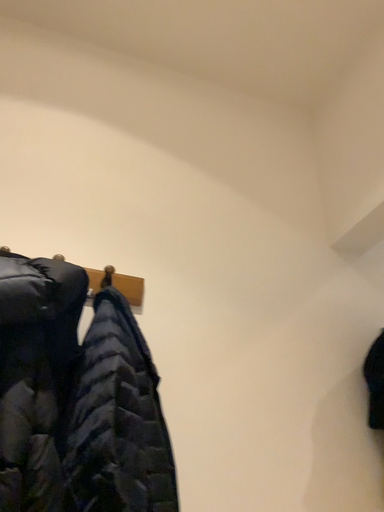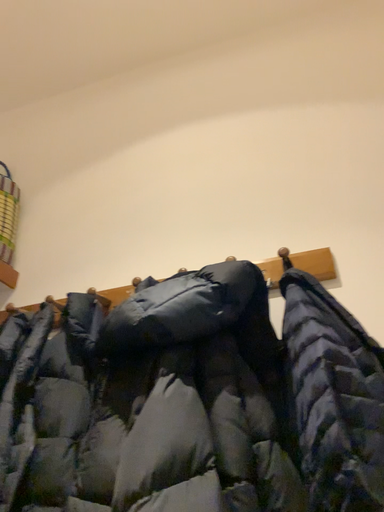
Question: Which way did the camera rotate in the video?

Choices:
 (A) rotated left
 (B) rotated right

Answer: (A)